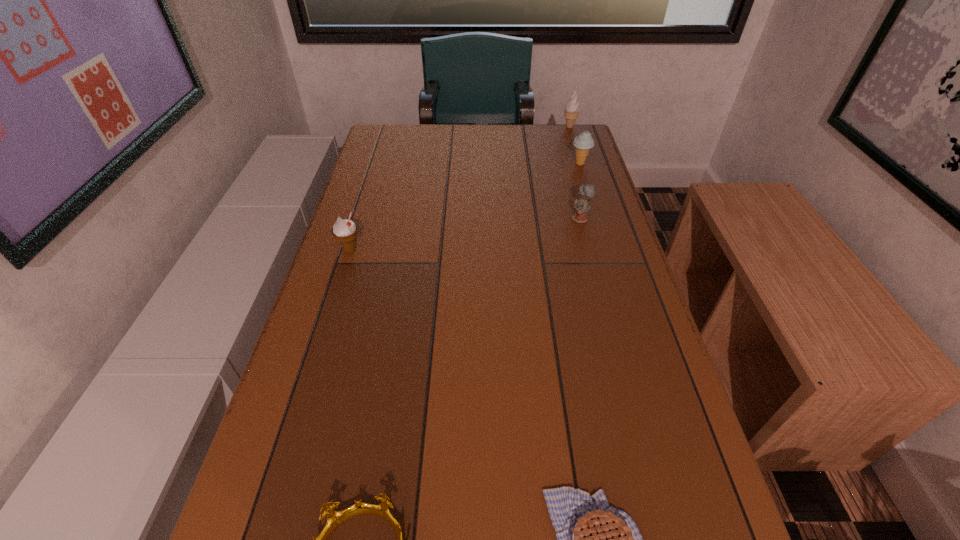
This screenshot has width=960, height=540. I want to click on the tallest icecream, so click(572, 108).

The height and width of the screenshot is (540, 960). Find the location of `the farthest icecream`. the farthest icecream is located at coordinates (572, 108).

In order to click on the fifth nearest object in this screenshot , I will do `click(584, 142)`.

I want to click on the third farthest object, so click(x=581, y=205).

The width and height of the screenshot is (960, 540). I want to click on the leftmost icecream, so click(344, 230).

Where is `the leftmost object`? This screenshot has height=540, width=960. the leftmost object is located at coordinates 344,230.

The image size is (960, 540). In order to click on vacant area situated 0.310m on the front-facing side of the farthest icecream in this screenshot , I will do [x=477, y=127].

In order to click on blank area located 0.140m on the front-facing side of the farthest icecream in this screenshot , I will do `click(523, 127)`.

Image resolution: width=960 pixels, height=540 pixels. In order to click on vacant area situated on the front-facing side of the farthest icecream in this screenshot , I will do `click(510, 127)`.

The image size is (960, 540). Find the location of `blank space located 0.280m on the front of the second farthest icecream`. blank space located 0.280m on the front of the second farthest icecream is located at coordinates (598, 224).